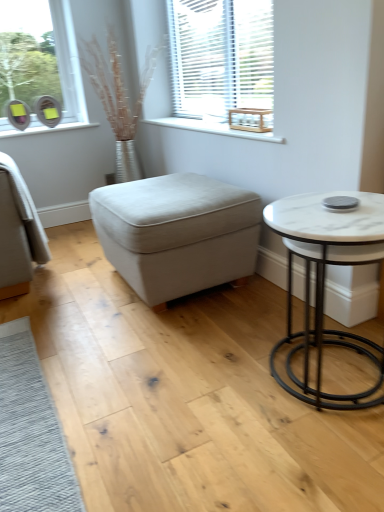
I want to click on vacant area situated below white marble table at right (from a real-world perspective), so click(x=322, y=376).